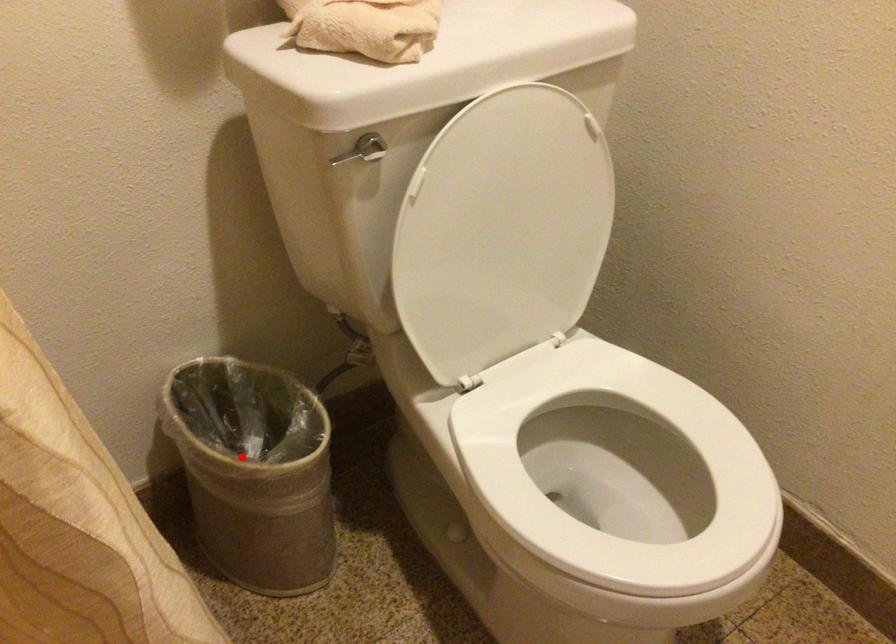
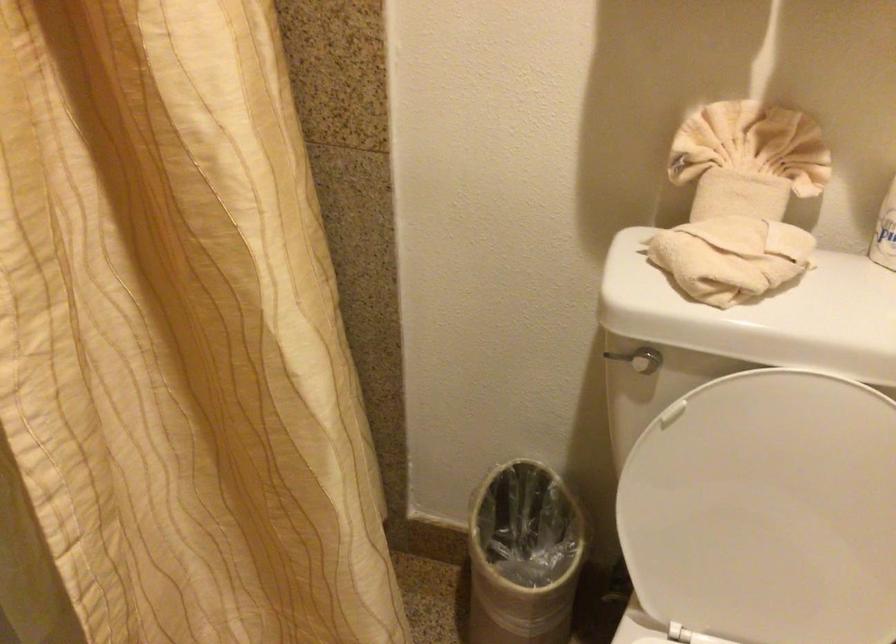
In the second image, find the point that corresponds to the highlighted location in the first image.

(522, 556)